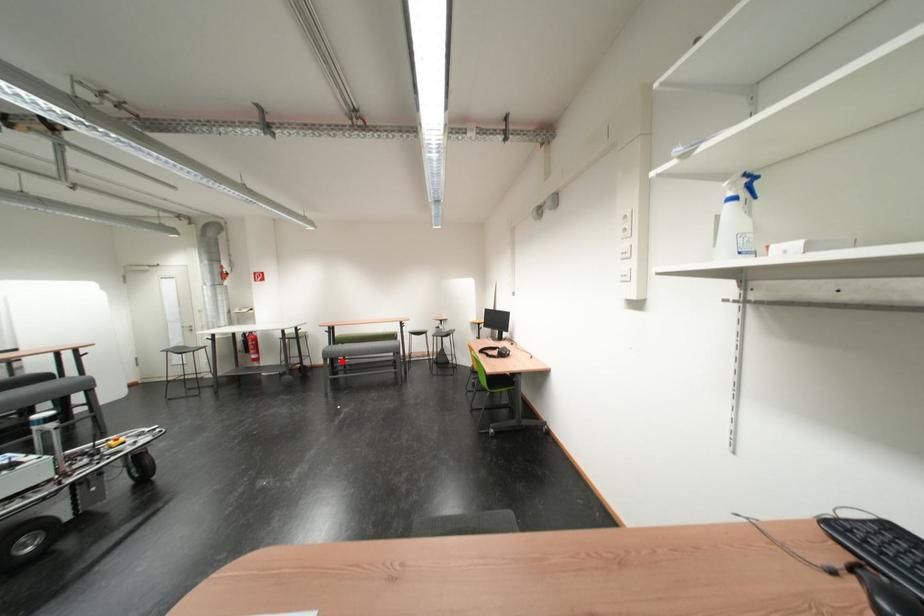
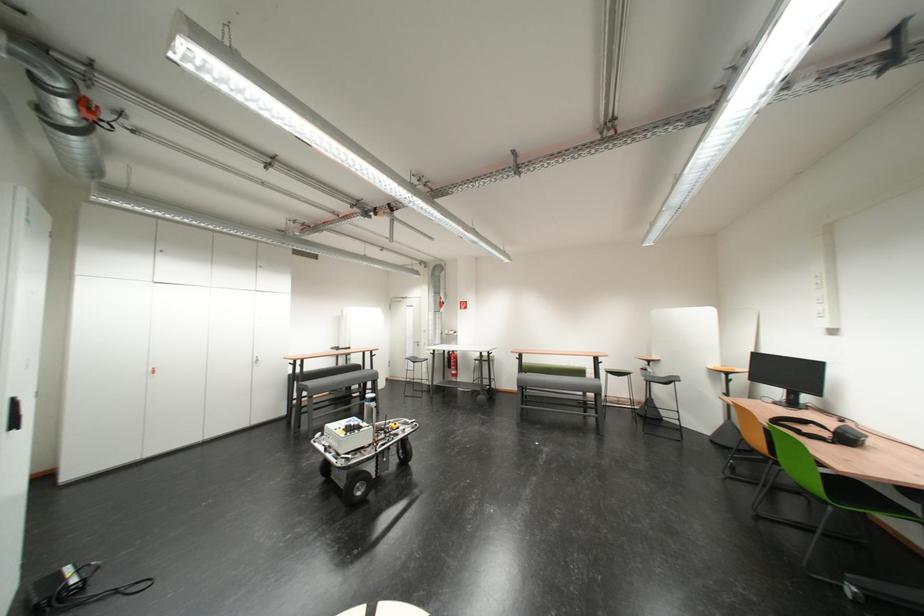
In the second image, find the point that corresponds to the highlighted location in the first image.

(532, 389)